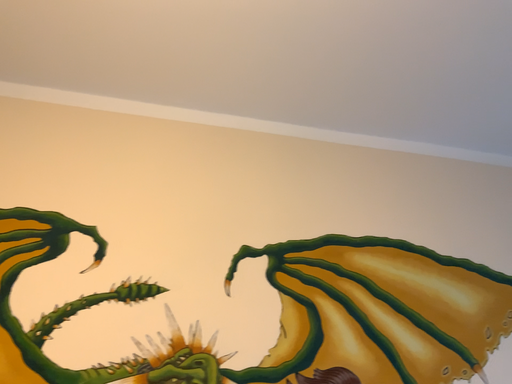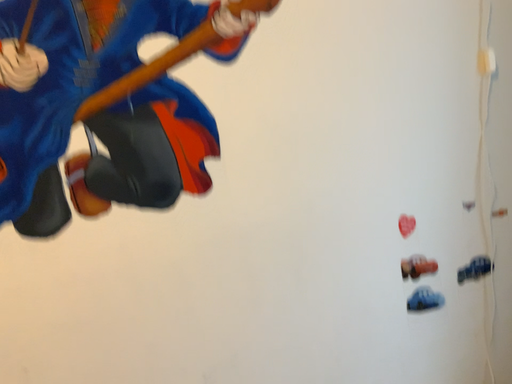
Question: How did the camera likely rotate when shooting the video?

Choices:
 (A) rotated upward
 (B) rotated downward

Answer: (B)